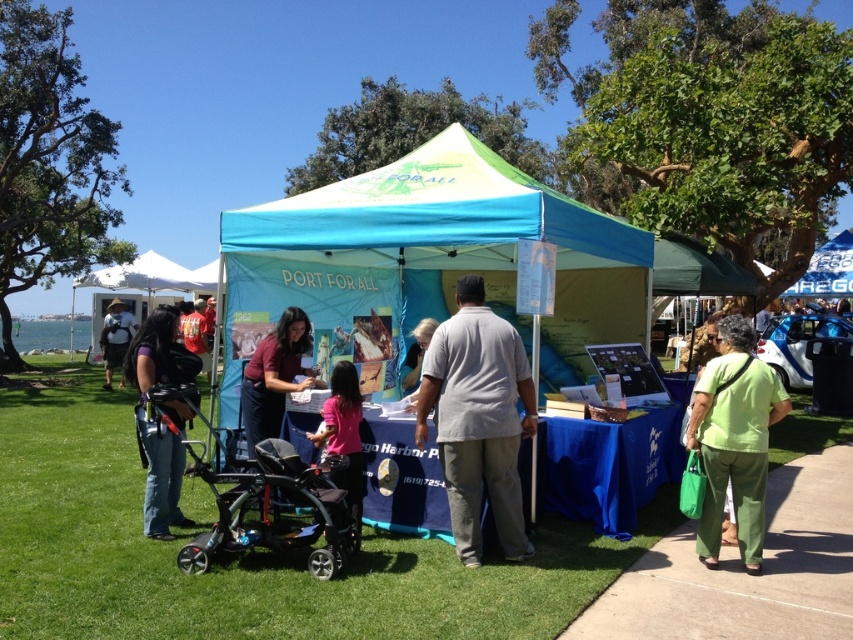
Who is shorter, maroon fabric shirt at center or pink matte shirt at center?

Standing shorter between the two is maroon fabric shirt at center.

Which is below, maroon fabric shirt at center or pink matte shirt at center?

Positioned lower is pink matte shirt at center.

Between point (276, 340) and point (344, 372), which one is positioned in front?

Point (344, 372) is more forward.

At what (x,y) coordinates should I click in order to perform the action: click on maroon fabric shirt at center. Please return your answer as a coordinate pair (x, y). This screenshot has height=640, width=853. Looking at the image, I should click on (x=276, y=376).

Is point (515, 339) closer to camera compared to point (840, 241)?

Yes.

Does gray cotton shirt at center have a lesser height compared to blue fabric canopy at upper center?

In fact, gray cotton shirt at center may be taller than blue fabric canopy at upper center.

Is point (444, 381) closer to camera compared to point (850, 275)?

Yes, it is.

Locate an element on the screen. This screenshot has height=640, width=853. gray cotton shirt at center is located at coordinates (479, 419).

Is point (286, 381) positioned behind point (421, 330)?

No, (286, 381) is in front of (421, 330).

Does maroon fabric shirt at center have a lesser width compared to light brown fabric shirt at center?

Incorrect, maroon fabric shirt at center's width is not less than light brown fabric shirt at center's.

Who is more forward, (274, 413) or (425, 339)?

Point (274, 413) is more forward.

Where is `maroon fabric shirt at center`? Image resolution: width=853 pixels, height=640 pixels. maroon fabric shirt at center is located at coordinates (276, 376).